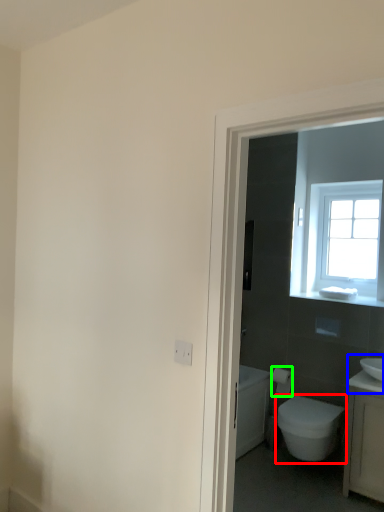
Question: Considering the real-world distances, which object is closest to bidet (highlighted by a red box)? sink (highlighted by a blue box) or toilet paper (highlighted by a green box).

Choices:
 (A) sink
 (B) toilet paper

Answer: (A)